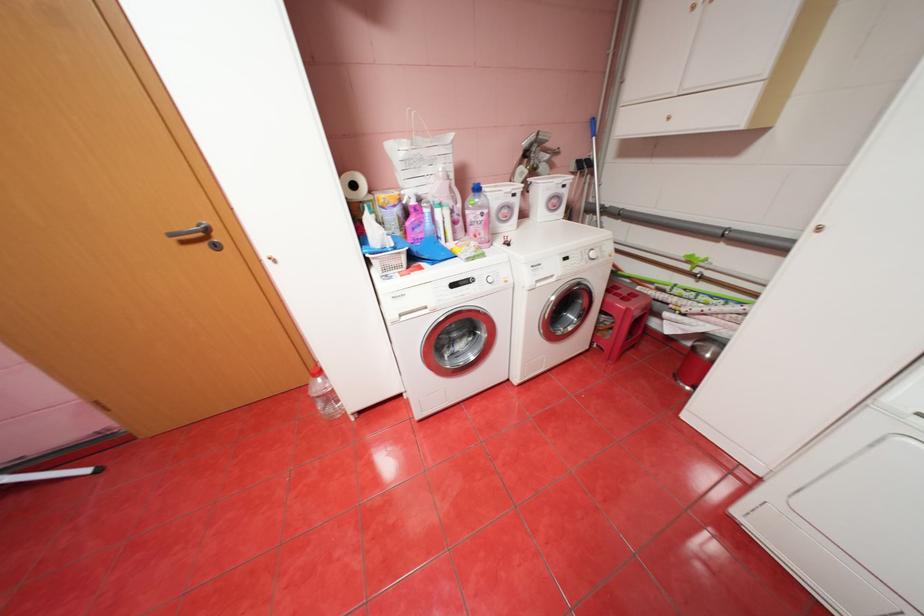
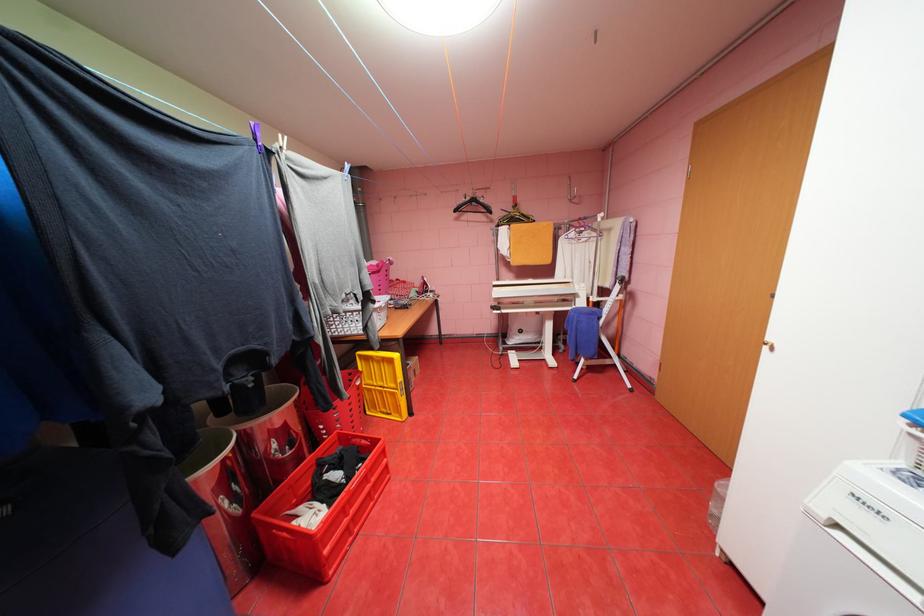
Locate, in the second image, the point that corresponds to (x=409, y=315) in the first image.

(845, 525)